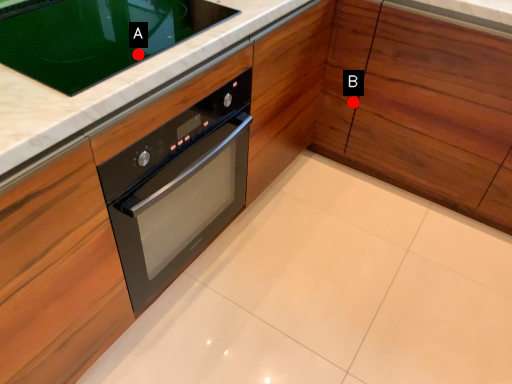
Question: Two points are circled on the image, labeled by A and B beside each circle. Which point is closer to the camera?

Choices:
 (A) A is closer
 (B) B is closer

Answer: (A)